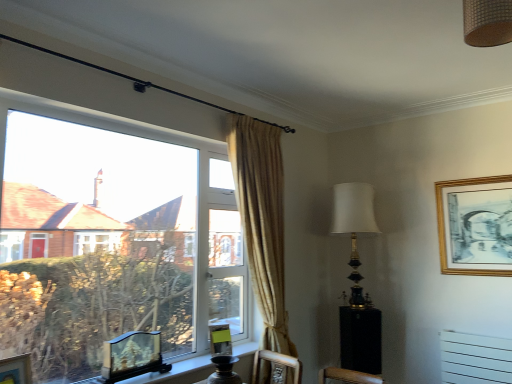
Question: From a real-world perspective, is clear glass window at left on top of gold metallic table lamp at upper right?

Choices:
 (A) no
 (B) yes

Answer: (A)

Question: Considering the relative positions of clear glass window at left and gold metallic table lamp at upper right in the image provided, is clear glass window at left to the left of gold metallic table lamp at upper right from the viewer's perspective?

Choices:
 (A) yes
 (B) no

Answer: (A)

Question: Can you confirm if clear glass window at left is thinner than gold metallic table lamp at upper right?

Choices:
 (A) no
 (B) yes

Answer: (B)

Question: From a real-world perspective, does clear glass window at left sit lower than gold metallic table lamp at upper right?

Choices:
 (A) no
 (B) yes

Answer: (B)

Question: Does clear glass window at left come behind gold metallic table lamp at upper right?

Choices:
 (A) no
 (B) yes

Answer: (A)

Question: Would you consider clear glass window at left to be distant from gold metallic table lamp at upper right?

Choices:
 (A) no
 (B) yes

Answer: (B)

Question: Does wooden carved picture frame at window, which is counted as the third picture frame, starting from the right, have a lesser height compared to gold/gilded picture frame at upper right, the 4th picture frame when ordered from bottom to top?

Choices:
 (A) yes
 (B) no

Answer: (A)

Question: Is wooden carved picture frame at window, the 2th picture frame from the bottom, in front of gold/gilded picture frame at upper right, placed as the first picture frame when sorted from top to bottom?

Choices:
 (A) no
 (B) yes

Answer: (B)

Question: Is wooden carved picture frame at window, the 2th picture frame from the bottom, positioned with its back to gold/gilded picture frame at upper right, which is counted as the fourth picture frame, starting from the left?

Choices:
 (A) no
 (B) yes

Answer: (A)

Question: Is wooden carved picture frame at window, which is counted as the 2th picture frame, starting from the front, far from gold/gilded picture frame at upper right, which is counted as the fourth picture frame, starting from the left?

Choices:
 (A) no
 (B) yes

Answer: (B)

Question: Considering the relative sizes of wooden carved picture frame at window, which is counted as the third picture frame, starting from the right, and gold/gilded picture frame at upper right, which appears as the fourth picture frame when viewed from the front, in the image provided, is wooden carved picture frame at window, which is counted as the third picture frame, starting from the right, wider than gold/gilded picture frame at upper right, which appears as the fourth picture frame when viewed from the front,?

Choices:
 (A) yes
 (B) no

Answer: (A)

Question: From the image's perspective, would you say wooden carved picture frame at window, which is counted as the third picture frame, starting from the right, is positioned over gold/gilded picture frame at upper right, which is counted as the fourth picture frame, starting from the left?

Choices:
 (A) yes
 (B) no

Answer: (B)

Question: From the image's perspective, does black glossy side table at lower right appear lower than gold/gilded picture frame at upper right, which appears as the fourth picture frame when viewed from the front?

Choices:
 (A) yes
 (B) no

Answer: (A)